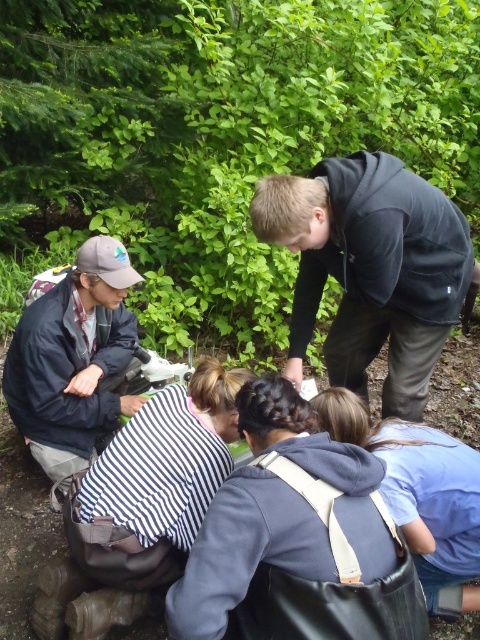
Question: Which of the following is the farthest from the observer?

Choices:
 (A) blue fabric backpack at lower center
 (B) dark gray hoodie at upper right

Answer: (B)

Question: Is dark gray hoodie at center thinner than blue fabric backpack at lower center?

Choices:
 (A) yes
 (B) no

Answer: (B)

Question: Which is farther from the white striped shirt at lower center?

Choices:
 (A) dark gray hoodie at upper right
 (B) dark gray hoodie at center
 (C) dark blue jacket at left
 (D) blue fabric backpack at lower center

Answer: (C)

Question: Can you confirm if dark blue jacket at left is wider than blue fabric backpack at lower center?

Choices:
 (A) yes
 (B) no

Answer: (A)

Question: Does dark blue jacket at left come behind blue fabric backpack at lower center?

Choices:
 (A) no
 (B) yes

Answer: (B)

Question: Which of the following is the closest to the observer?

Choices:
 (A) (349, 477)
 (B) (182, 561)
 (C) (103, 353)

Answer: (A)